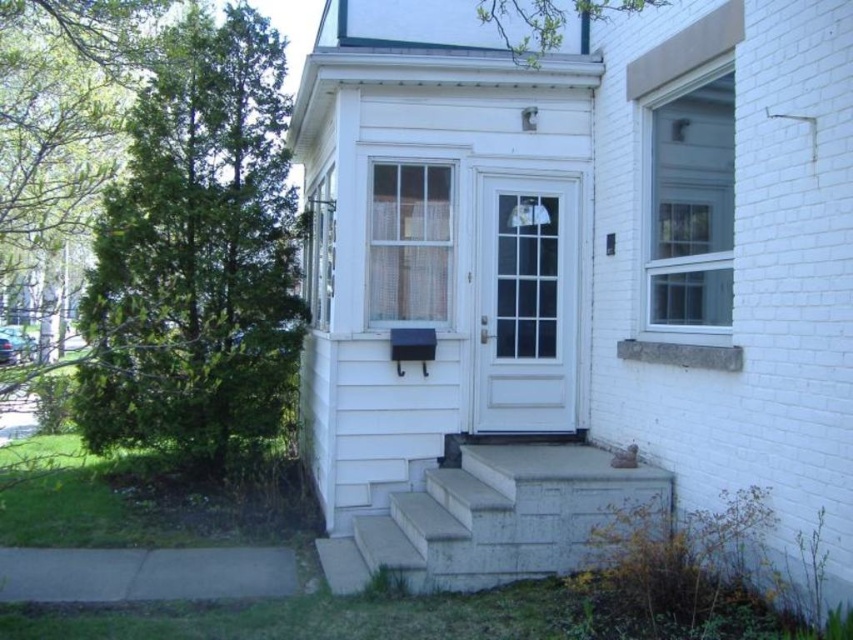
Question: Which point is farther from the camera taking this photo?

Choices:
 (A) (428, 516)
 (B) (572, 538)

Answer: (A)

Question: Can you confirm if white glossy door at center is wider than concrete/stone steps at lower center?

Choices:
 (A) yes
 (B) no

Answer: (B)

Question: Is the position of white glossy door at center more distant than that of concrete/stone steps at lower center?

Choices:
 (A) no
 (B) yes

Answer: (B)

Question: Which of the following is the farthest from the observer?

Choices:
 (A) (378, 557)
 (B) (480, 504)
 (C) (495, 317)

Answer: (C)

Question: Is the position of concrete at center less distant than that of concrete/stone steps at lower center?

Choices:
 (A) yes
 (B) no

Answer: (A)

Question: Which object is the closest to the concrete at center?

Choices:
 (A) white glossy door at center
 (B) concrete/stone steps at lower center

Answer: (B)